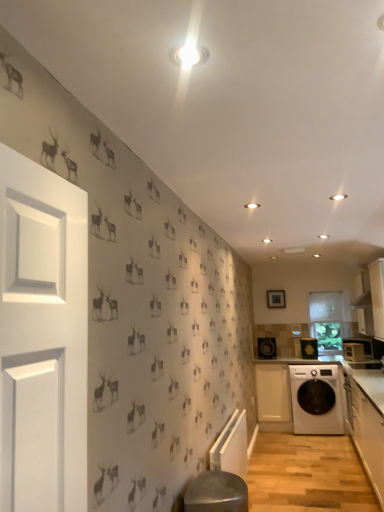
Question: Considering the relative sizes of white matte cabinet at lower right, the third cabinetry when ordered from front to back, and black plastic speaker at center, marked as the 1th appliance in a back-to-front arrangement, in the image provided, is white matte cabinet at lower right, the third cabinetry when ordered from front to back, shorter than black plastic speaker at center, marked as the 1th appliance in a back-to-front arrangement,?

Choices:
 (A) yes
 (B) no

Answer: (B)

Question: Is white matte cabinet at lower right, the third cabinetry when ordered from front to back, located outside black plastic speaker at center, the 1th appliance in the left-to-right sequence?

Choices:
 (A) yes
 (B) no

Answer: (A)

Question: Is white matte cabinet at lower right, acting as the first cabinetry starting from the back, positioned before black plastic speaker at center, which is counted as the 3th appliance, starting from the right?

Choices:
 (A) no
 (B) yes

Answer: (B)

Question: Is white matte cabinet at lower right, acting as the first cabinetry starting from the back, looking in the opposite direction of black plastic speaker at center, the 1th appliance in the left-to-right sequence?

Choices:
 (A) no
 (B) yes

Answer: (A)

Question: From the image's perspective, is white matte cabinet at lower right, the third cabinetry when ordered from front to back, above black plastic speaker at center, the 1th appliance in the left-to-right sequence?

Choices:
 (A) yes
 (B) no

Answer: (B)

Question: Considering the positions of white glossy cabinet at upper right, which ranks as the 2th cabinetry in front-to-back order, and metallic stool at lower center in the image, is white glossy cabinet at upper right, which ranks as the 2th cabinetry in front-to-back order, wider or thinner than metallic stool at lower center?

Choices:
 (A) thin
 (B) wide

Answer: (A)

Question: Considering the relative positions of white glossy cabinet at upper right, which ranks as the 2th cabinetry in front-to-back order, and metallic stool at lower center in the image provided, is white glossy cabinet at upper right, which ranks as the 2th cabinetry in front-to-back order, to the left or to the right of metallic stool at lower center?

Choices:
 (A) left
 (B) right

Answer: (B)

Question: From a real-world perspective, is white glossy cabinet at upper right, arranged as the 2th cabinetry when viewed from the back, physically located above or below metallic stool at lower center?

Choices:
 (A) below
 (B) above

Answer: (B)

Question: Relative to metallic stool at lower center, is white glossy cabinet at upper right, which ranks as the 2th cabinetry in front-to-back order, in front or behind?

Choices:
 (A) behind
 (B) front

Answer: (A)

Question: Would you say white glossy washing machine at lower right, the second appliance when ordered from left to right, is inside or outside white matte cabinet at lower right, acting as the first cabinetry starting from the back?

Choices:
 (A) inside
 (B) outside

Answer: (B)

Question: From the image's perspective, relative to white matte cabinet at lower right, acting as the first cabinetry starting from the back, is white glossy washing machine at lower right, the second appliance when ordered from left to right, above or below?

Choices:
 (A) below
 (B) above

Answer: (B)

Question: Is point (309, 352) closer or farther from the camera than point (281, 375)?

Choices:
 (A) closer
 (B) farther

Answer: (B)

Question: From a real-world perspective, is white glossy washing machine at lower right, the second appliance when ordered from left to right, positioned above or below white matte cabinet at lower right, the third cabinetry when ordered from front to back?

Choices:
 (A) above
 (B) below

Answer: (A)

Question: Considering the positions of white glossy microwave at right, marked as the first appliance in a right-to-left arrangement, and white matte cabinet at lower right, the third cabinetry when ordered from front to back, in the image, is white glossy microwave at right, marked as the first appliance in a right-to-left arrangement, taller or shorter than white matte cabinet at lower right, the third cabinetry when ordered from front to back,?

Choices:
 (A) short
 (B) tall

Answer: (A)

Question: Looking at the image, does white glossy microwave at right, arranged as the 3th appliance when viewed from the back, seem bigger or smaller compared to white matte cabinet at lower right, acting as the first cabinetry starting from the back?

Choices:
 (A) big
 (B) small

Answer: (B)